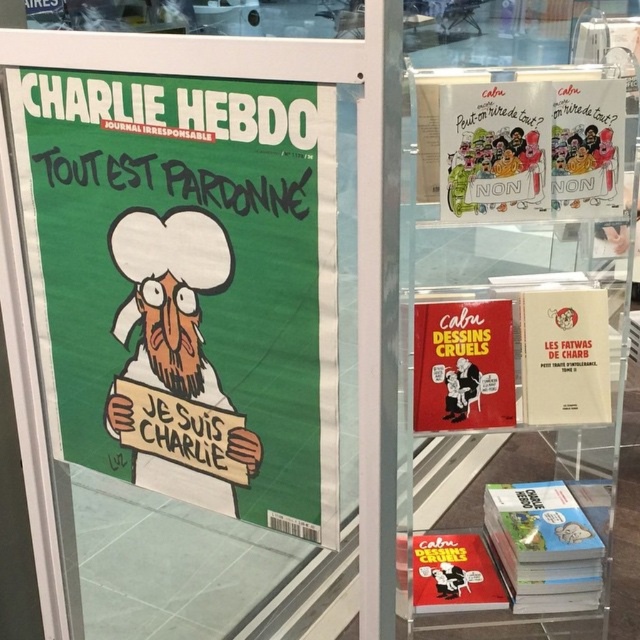
Question: Which point is closer to the camera?

Choices:
 (A) green matte poster at left
 (B) matte paper poster at upper center

Answer: (A)

Question: Among these points, which one is nearest to the camera?

Choices:
 (A) click(x=481, y=74)
 (B) click(x=609, y=420)
 (C) click(x=550, y=200)
 (D) click(x=452, y=317)

Answer: (A)

Question: Is transparent plastic display case at center below matte paper poster at upper center?

Choices:
 (A) yes
 (B) no

Answer: (A)

Question: Is transparent plastic display case at center above matte paper poster at upper right?

Choices:
 (A) no
 (B) yes

Answer: (A)

Question: Which object appears closest to the camera in this image?

Choices:
 (A) matte paper poster at upper center
 (B) matte paper poster at upper right

Answer: (A)

Question: In this image, where is matte paper poster at upper center located relative to matte red book at lower center?

Choices:
 (A) left
 (B) right

Answer: (B)